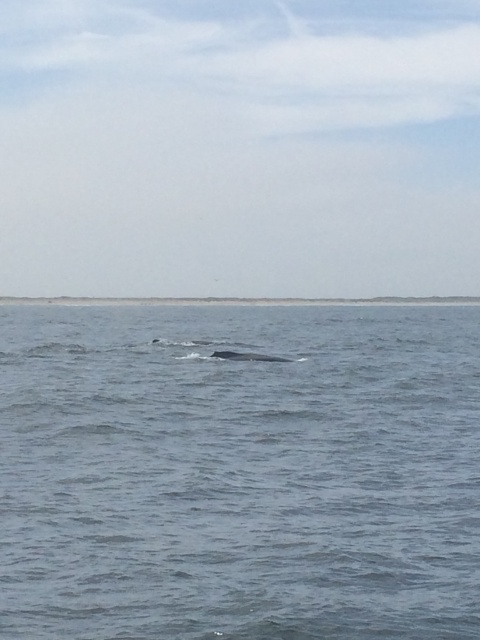
Who is more forward, (308, 385) or (280, 358)?

Point (308, 385)

Is gray matte water at center further to the viewer compared to gray matte whale at center?

Result: No, it is in front of gray matte whale at center.

Describe the element at coordinates (239, 472) in the screenshot. I see `gray matte water at center` at that location.

I want to click on gray matte water at center, so click(x=239, y=472).